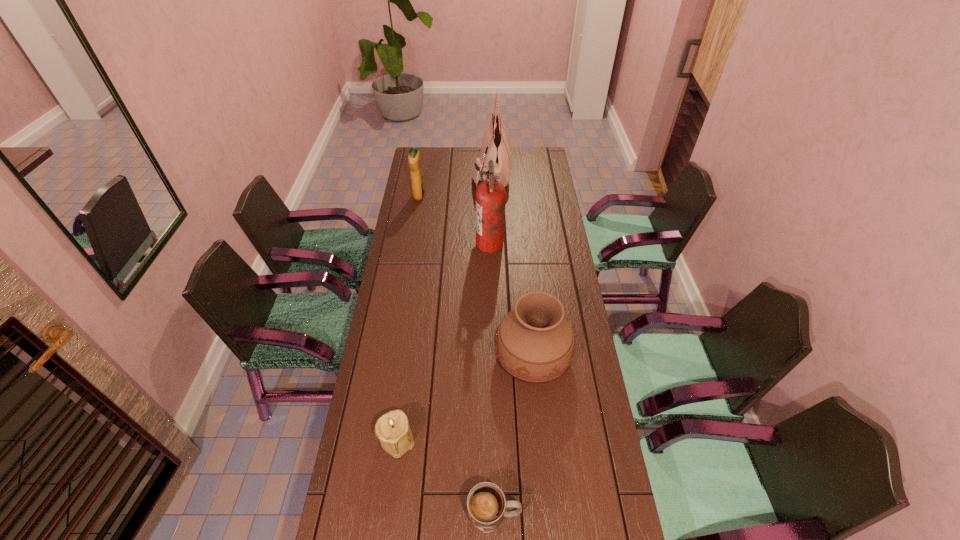
This screenshot has height=540, width=960. Identify the location of blank area in the image that satisfies the following two spatial constraints: 1. on the label of the second nearest object; 2. on the right side of the detergent. pyautogui.click(x=379, y=439).

Find the location of a particular element. The image size is (960, 540). free point that satisfies the following two spatial constraints: 1. on the label of the detergent; 2. on the back side of the third nearest object is located at coordinates (393, 356).